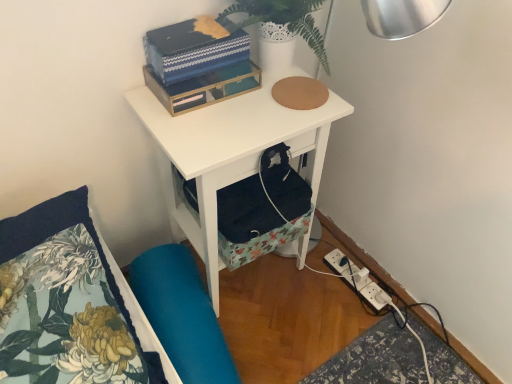
This screenshot has width=512, height=384. Find the location of `free spot above teal fabric swivel chair at lower left (from a real-world perspective)`. free spot above teal fabric swivel chair at lower left (from a real-world perspective) is located at coordinates (176, 319).